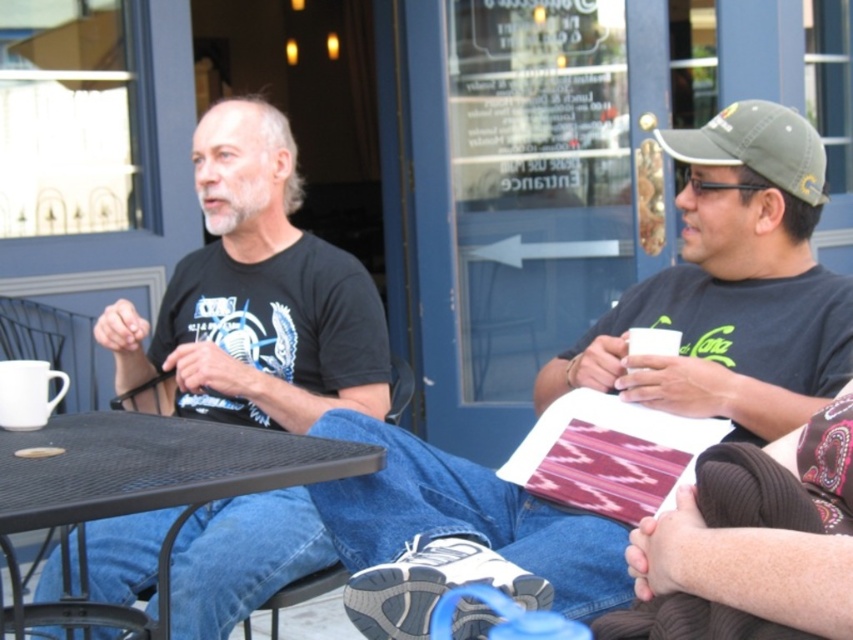
Does point (589, 595) lie in front of point (747, 164)?

Yes, point (589, 595) is closer to viewer.

Who is positioned more to the left, blue denim jeans at lower center or olive green fabric baseball cap at upper right?

blue denim jeans at lower center

Find the location of a particular element. The height and width of the screenshot is (640, 853). blue denim jeans at lower center is located at coordinates (456, 536).

Is matte black t-shirt at center bigger than olive green fabric baseball cap at upper right?

Indeed, matte black t-shirt at center has a larger size compared to olive green fabric baseball cap at upper right.

Between matte black t-shirt at center and olive green fabric baseball cap at upper right, which one is positioned higher?

olive green fabric baseball cap at upper right

Between point (837, 349) and point (827, 196), which one is positioned in front?

Point (837, 349) is more forward.

I want to click on matte black t-shirt at center, so pyautogui.click(x=730, y=288).

Can you confirm if black matte t-shirt at center is positioned to the right of olive green fabric baseball cap at upper right?

Incorrect, black matte t-shirt at center is not on the right side of olive green fabric baseball cap at upper right.

Describe the element at coordinates (257, 296) in the screenshot. I see `black matte t-shirt at center` at that location.

This screenshot has height=640, width=853. Identify the location of black matte t-shirt at center. (257, 296).